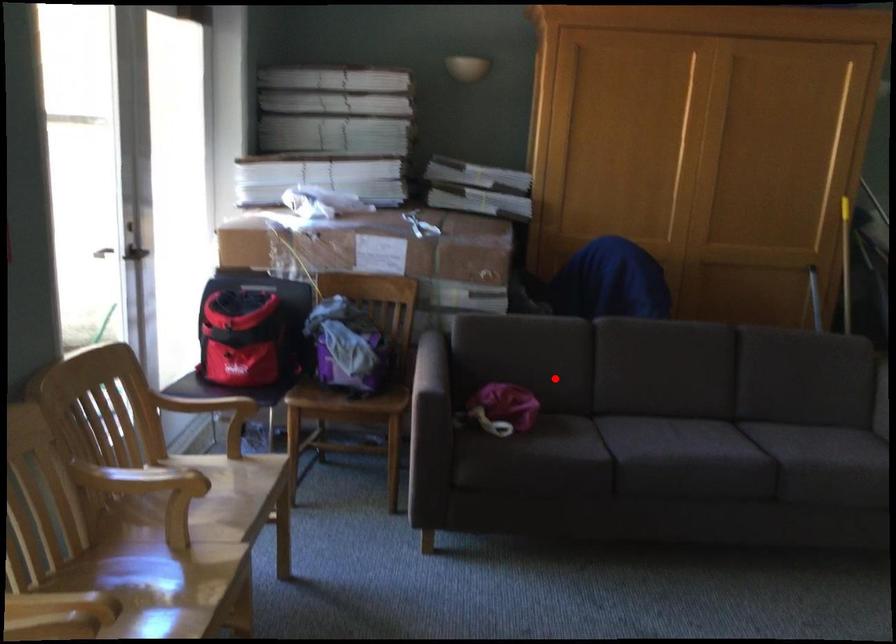
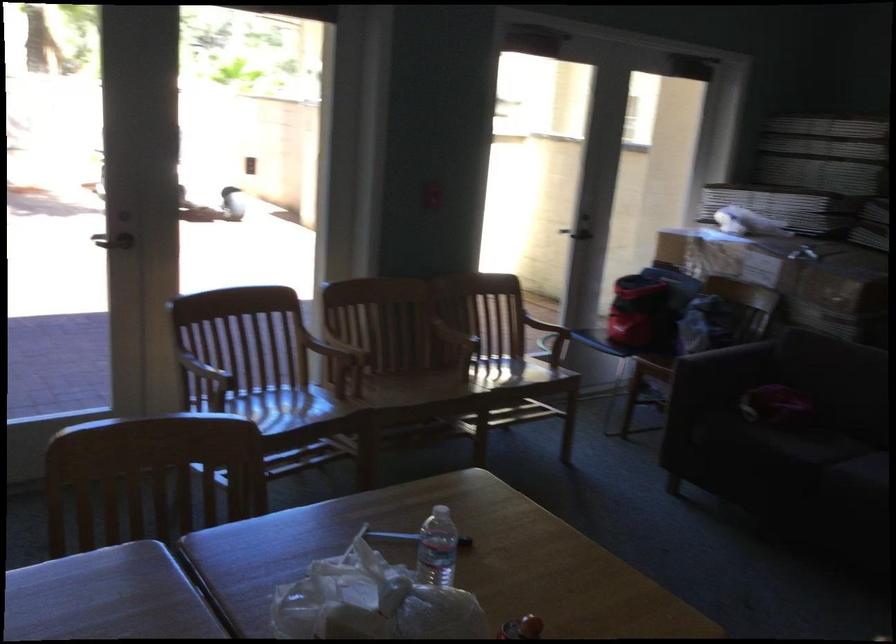
Locate, in the second image, the point that corresponds to the highlighted location in the first image.

(843, 392)